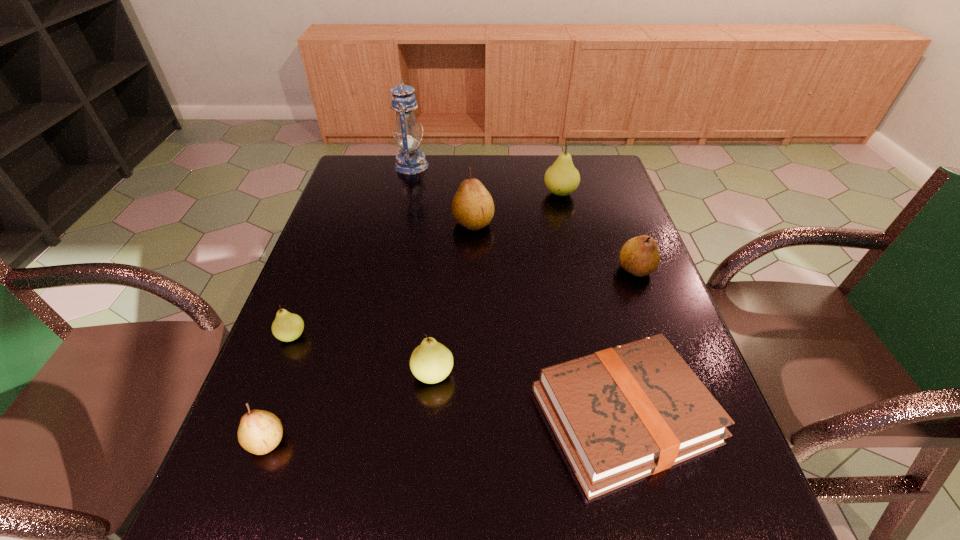
Locate which green pear is the third closest to the smallest brown pear. Please provide its 2D coordinates. Your answer should be formatted as a tuple, i.e. [(x, y)], where the tuple contains the x and y coordinates of a point satisfying the conditions above.

[(562, 178)]

Image resolution: width=960 pixels, height=540 pixels. Find the location of `brown pear that is the second closest to the second brown pear from right to left`. brown pear that is the second closest to the second brown pear from right to left is located at coordinates (259, 432).

Find the location of `brown pear that can be found as the third closest to the second nearest pear`. brown pear that can be found as the third closest to the second nearest pear is located at coordinates (640, 256).

Where is `vacant space that satisfies the following two spatial constraints: 1. on the front-facing side of the hardback book; 2. on the left side of the farthest object`? Image resolution: width=960 pixels, height=540 pixels. vacant space that satisfies the following two spatial constraints: 1. on the front-facing side of the hardback book; 2. on the left side of the farthest object is located at coordinates (357, 415).

This screenshot has height=540, width=960. Identify the location of vacant space that satisfies the following two spatial constraints: 1. on the front-facing side of the second smallest green pear; 2. on the left side of the tallest object. (367, 374).

You are a GUI agent. You are given a task and a screenshot of the screen. Output one action in this format:
    pyautogui.click(x=<x>, y=<y>)
    Task: Click on the free spot that satisfies the following two spatial constraints: 1. on the front side of the third farthest object; 2. on the left side of the rightmost pear
    Image resolution: width=960 pixels, height=540 pixels.
    Given the screenshot: What is the action you would take?
    pyautogui.click(x=472, y=269)

At what (x,y) coordinates should I click in order to perform the action: click on vacant space that satisfies the following two spatial constraints: 1. on the front-facing side of the sixth object from right to left; 2. on the left side of the nearest green pear. Please return your answer as a coordinate pair (x, y). Looking at the image, I should click on (367, 374).